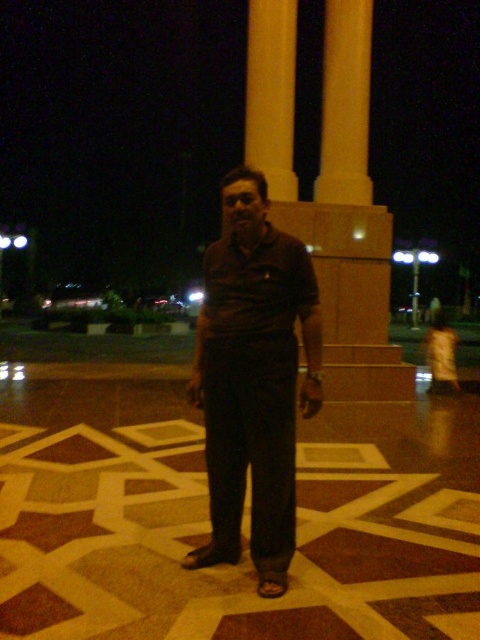
Measure the distance from matte brown shirt at center to yellow polished stone pillar at upper center.

They are 5.69 meters apart.

Who is higher up, matte brown shirt at center or yellow polished stone pillar at upper center?

yellow polished stone pillar at upper center is above.

What do you see at coordinates (253, 378) in the screenshot? Image resolution: width=480 pixels, height=640 pixels. I see `matte brown shirt at center` at bounding box center [253, 378].

At what (x,y) coordinates should I click in order to perform the action: click on matte brown shirt at center. Please return your answer as a coordinate pair (x, y). Looking at the image, I should click on pyautogui.click(x=253, y=378).